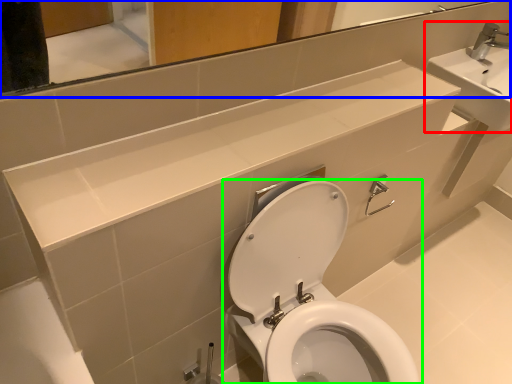
Question: Estimate the real-world distances between objects in this image. Which object is farther from sink (highlighted by a red box), mirror (highlighted by a blue box) or toilet (highlighted by a green box)?

Choices:
 (A) mirror
 (B) toilet

Answer: (B)